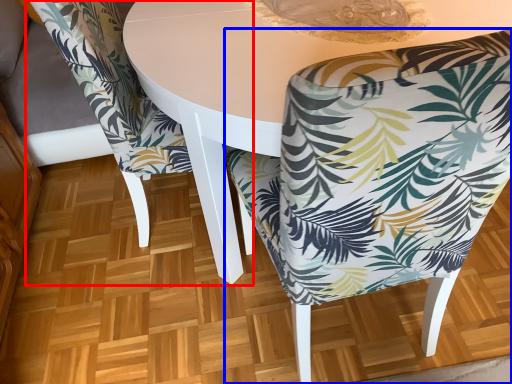
Question: Which object is closer to the camera taking this photo, chair (highlighted by a red box) or chair (highlighted by a blue box)?

Choices:
 (A) chair
 (B) chair

Answer: (B)